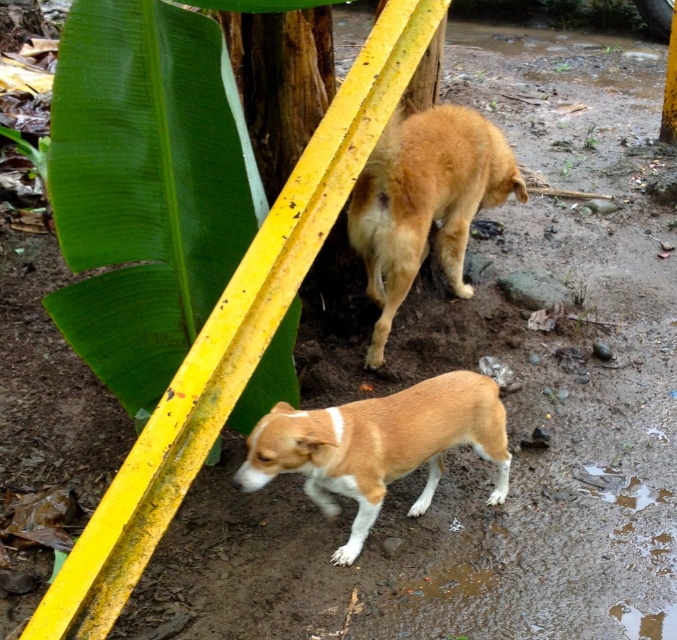
Question: Does brown fur dog at center have a greater width compared to brown furry dog at center?

Choices:
 (A) yes
 (B) no

Answer: (A)

Question: Which of the following is the farthest from the observer?

Choices:
 (A) brown furry dog at center
 (B) brown fur dog at center

Answer: (A)

Question: Among these objects, which one is farthest from the camera?

Choices:
 (A) brown furry dog at center
 (B) brown fur dog at center

Answer: (A)

Question: Is brown fur dog at center to the right of brown furry dog at center from the viewer's perspective?

Choices:
 (A) yes
 (B) no

Answer: (B)

Question: Is brown fur dog at center wider than brown furry dog at center?

Choices:
 (A) no
 (B) yes

Answer: (B)